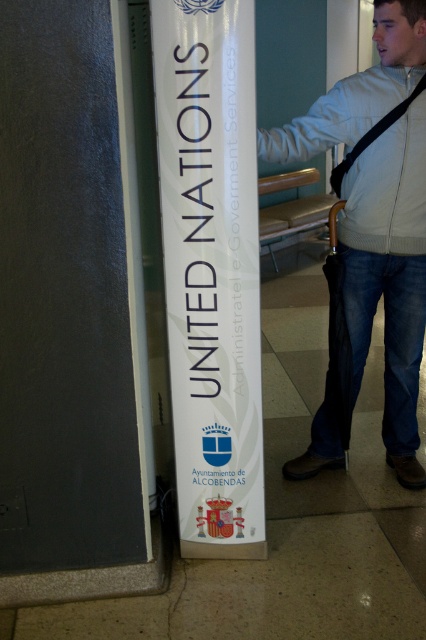
Question: Observing the image, what is the correct spatial positioning of white paper sign at center in reference to light gray zip-up jacket at center?

Choices:
 (A) right
 (B) left

Answer: (B)

Question: Can you confirm if white paper sign at center is thinner than light gray zip-up jacket at center?

Choices:
 (A) yes
 (B) no

Answer: (A)

Question: Which object is farther from the camera taking this photo?

Choices:
 (A) white paper sign at center
 (B) light gray zip-up jacket at center

Answer: (B)

Question: Does white paper sign at center come behind light gray zip-up jacket at center?

Choices:
 (A) no
 (B) yes

Answer: (A)